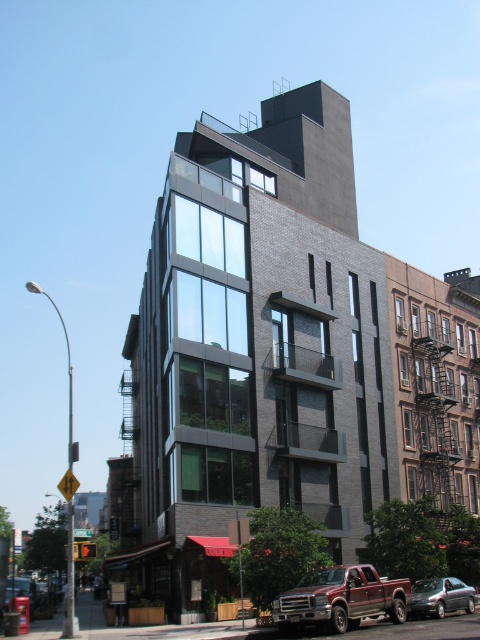
You are a delivery person who needs to park your vehicle in a space that can accommodate your vehicle height. The parking lot has a height restriction of 1.8 meters. You observe the matte red truck at lower right and the metallic silver sedan at center in the image. Which vehicle is more likely to exceed the height limit?

The matte red truck at lower right has a greater height compared to the metallic silver sedan at center. Since the truck is taller, it is more likely to exceed the 1.8 meters height limit.

You are a pedestrian standing in front of the building. You see a matte red truck at lower right and a metallic silver sedan at center. Which vehicle is nearer to you?

The matte red truck at lower right is closer to the viewer than the metallic silver sedan at center.

You are a delivery person trying to access the loading dock located behind the matte red truck at lower right. The metallic silver sedan at center is blocking your path. Can you drive around the sedan to reach the truck?

The matte red truck at lower right is positioned over the metallic silver sedan at center, meaning the sedan is underneath the truck. Since the truck is already above the sedan, you can safely drive around the sedan to reach the truck without obstruction.